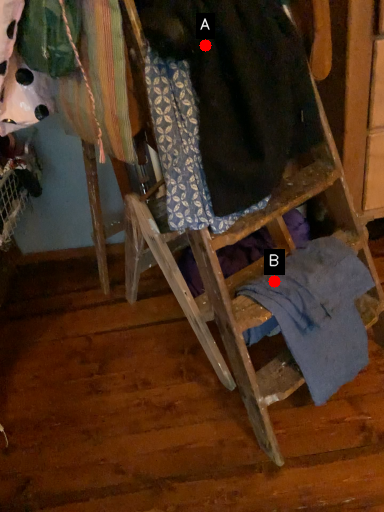
Question: Two points are circled on the image, labeled by A and B beside each circle. Which point is farther from the camera taking this photo?

Choices:
 (A) A is further
 (B) B is further

Answer: (B)